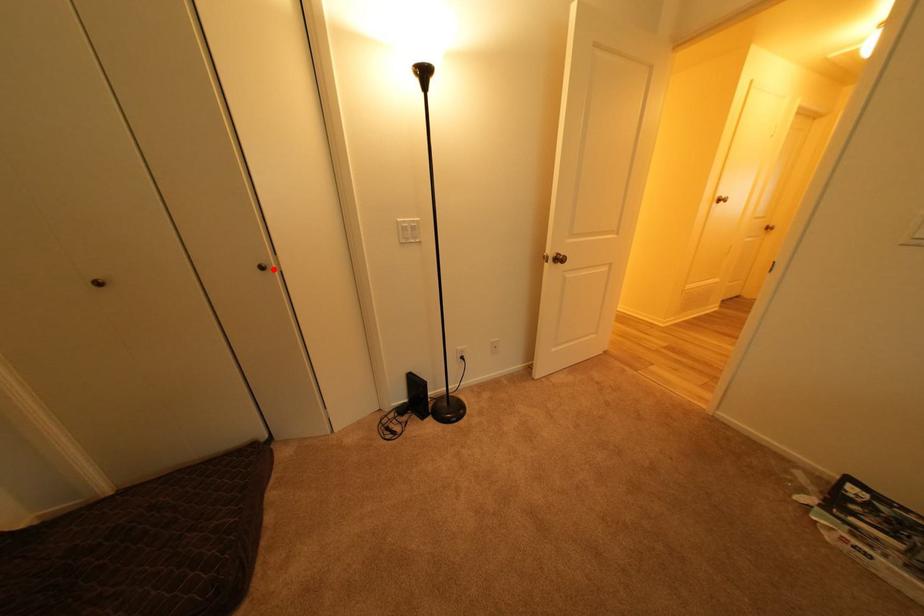
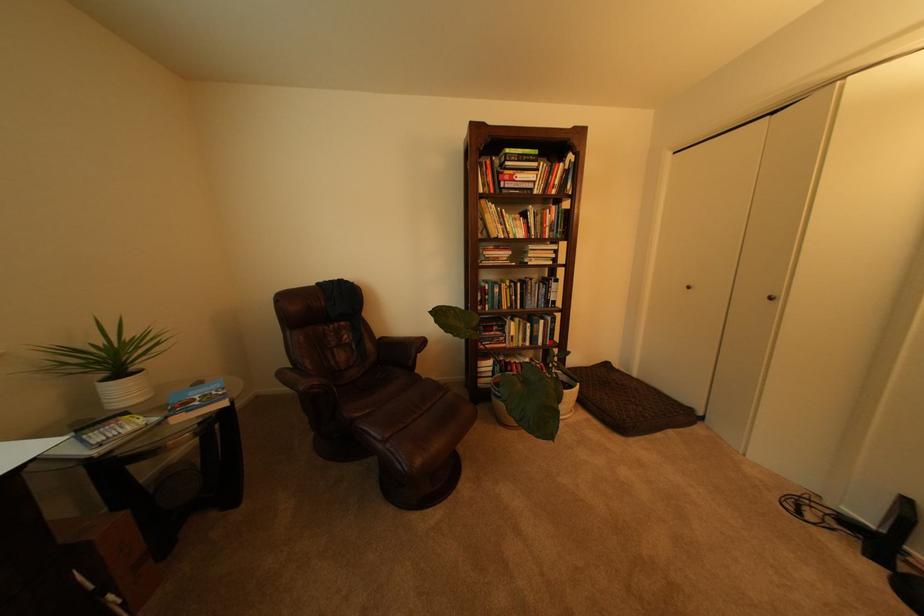
Find the pixel in the second image that matches the highlighted location in the first image.

(782, 300)